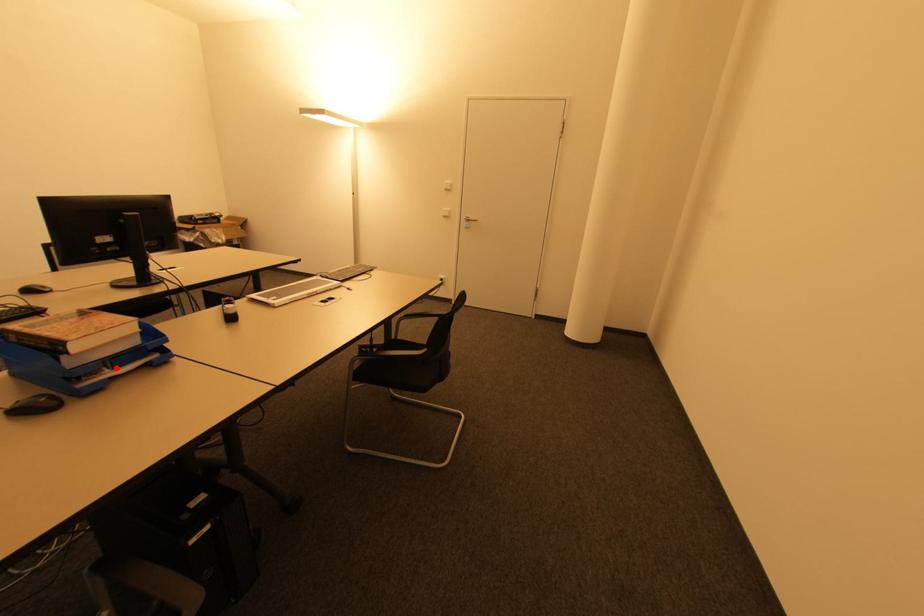
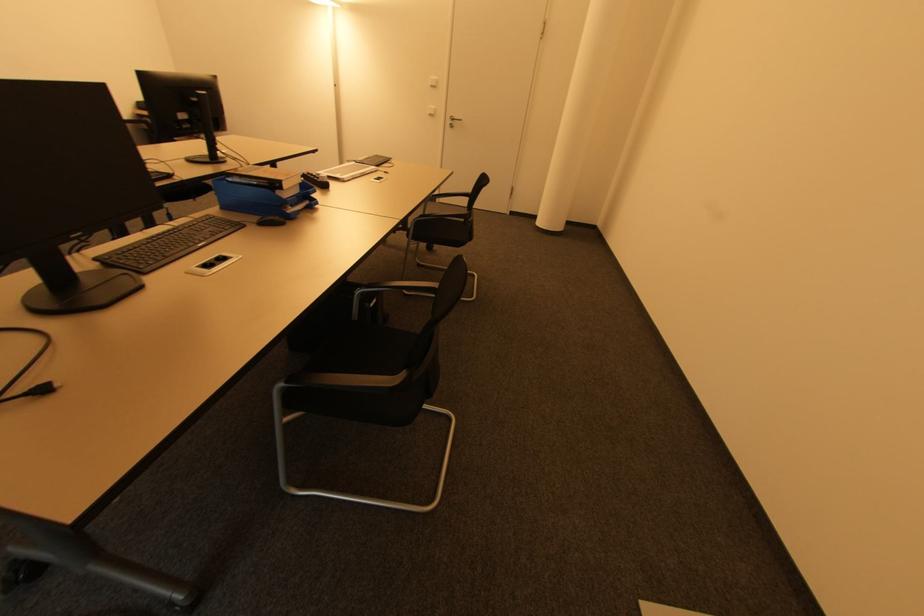
In the second image, find the point that corresponds to the highlighted location in the first image.

(294, 207)